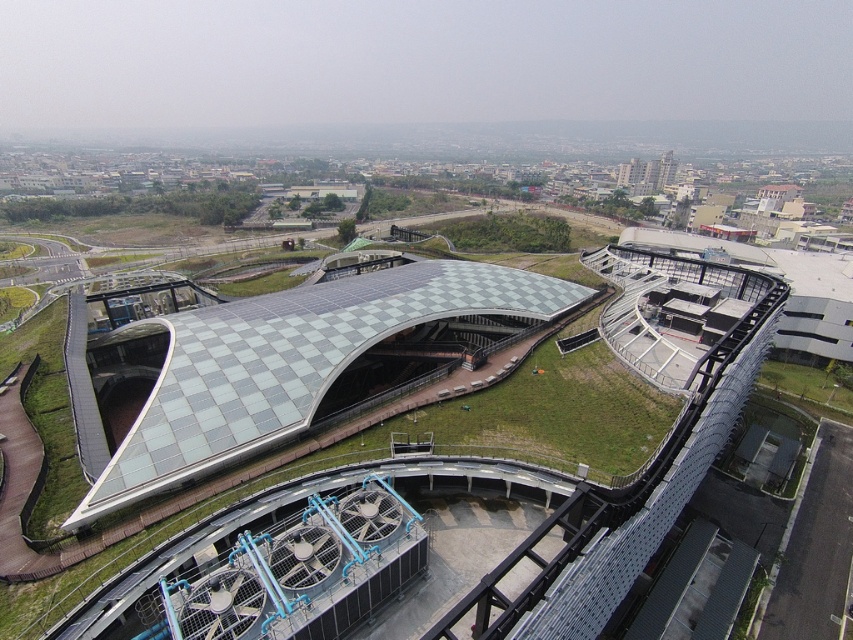
Question: Does checkered glass roof at center appear under green grass at lower right?

Choices:
 (A) no
 (B) yes

Answer: (A)

Question: Which of the following is the closest to the observer?

Choices:
 (A) green grass at lower right
 (B) checkered glass roof at center

Answer: (B)

Question: Is checkered glass roof at center to the left of green grass at lower right from the viewer's perspective?

Choices:
 (A) no
 (B) yes

Answer: (B)

Question: Among these points, which one is nearest to the camera?

Choices:
 (A) (152, 454)
 (B) (811, 394)

Answer: (A)

Question: Does checkered glass roof at center lie in front of green grass at lower right?

Choices:
 (A) yes
 (B) no

Answer: (A)